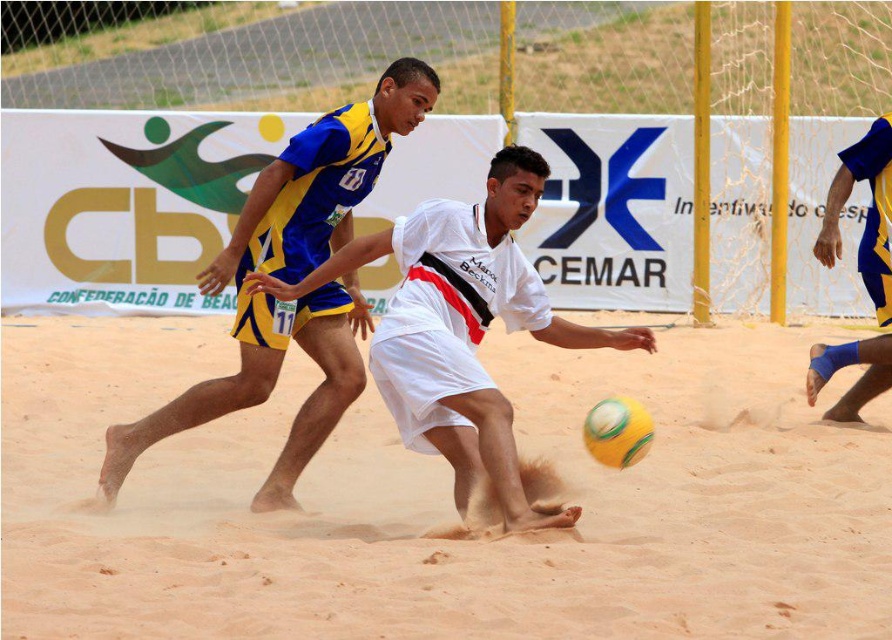
Is white matte jersey at center below blue/yellow jersey at center?

Yes, white matte jersey at center is below blue/yellow jersey at center.

Who is higher up, white matte jersey at center or blue/yellow jersey at center?

blue/yellow jersey at center

Is point (401, 328) less distant than point (337, 384)?

Yes, point (401, 328) is closer to viewer.

Locate an element on the screen. The height and width of the screenshot is (640, 892). white matte jersey at center is located at coordinates (461, 330).

Between white matte jersey at center and blue/yellow jersey at right, which one appears on the left side from the viewer's perspective?

white matte jersey at center is more to the left.

Does white matte jersey at center appear on the left side of blue/yellow jersey at right?

Indeed, white matte jersey at center is positioned on the left side of blue/yellow jersey at right.

Which is behind, point (366, 243) or point (838, 364)?

The point (838, 364) is behind.

The width and height of the screenshot is (892, 640). I want to click on white matte jersey at center, so click(461, 330).

Does point (45, 369) come behind point (329, 406)?

Yes, it is.

Is fine-grained sand at center bigger than blue/yellow jersey at center?

No.

Locate an element on the screen. This screenshot has width=892, height=640. fine-grained sand at center is located at coordinates (442, 502).